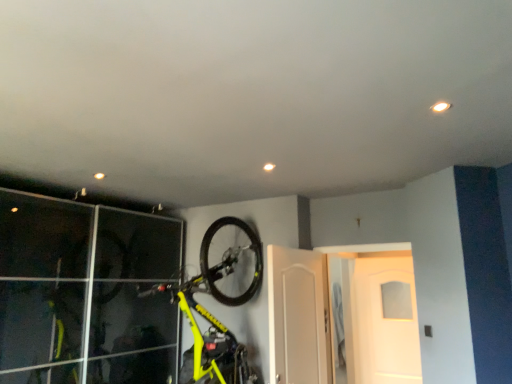
Question: Is white matte door at center, placed as the 1th door when sorted from front to back, wider or thinner than white glossy door at center, arranged as the 2th door when viewed from the back?

Choices:
 (A) thin
 (B) wide

Answer: (A)

Question: From their relative heights in the image, would you say white matte door at center, placed as the 1th door when sorted from front to back, is taller or shorter than white glossy door at center, the second door viewed from the front?

Choices:
 (A) tall
 (B) short

Answer: (B)

Question: Estimate the real-world distances between objects in this image. Which object is farther from the white glossy door at center, which is the 1th door in back-to-front order?

Choices:
 (A) yellow matte bicycle at upper center
 (B) white glossy door at center, arranged as the 2th door when viewed from the back
 (C) white matte door at center, placed as the 1th door when sorted from front to back

Answer: (A)

Question: Which object is positioned farthest from the yellow matte bicycle at upper center?

Choices:
 (A) white matte door at center, the 3th door in the back-to-front sequence
 (B) white glossy door at center, the second door viewed from the front
 (C) white glossy door at center, the third door when ordered from front to back

Answer: (C)